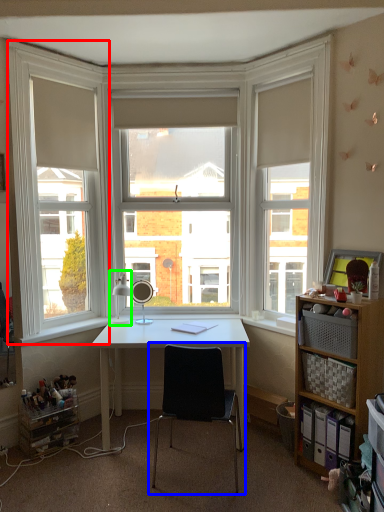
Question: Which is farther away from window frame (highlighted by a red box)? chair (highlighted by a blue box) or table lamp (highlighted by a green box)?

Choices:
 (A) chair
 (B) table lamp

Answer: (A)